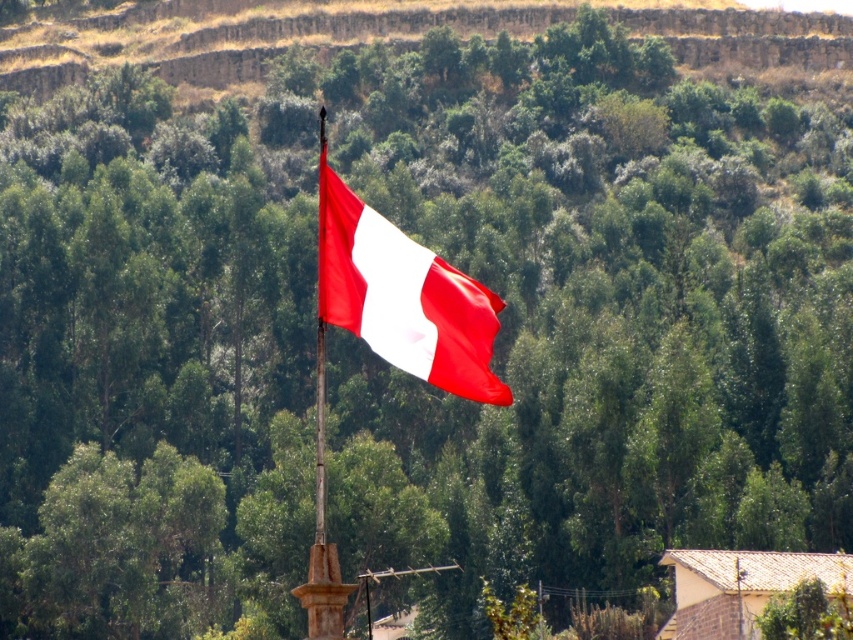
Is matte fabric flag at center positioned in front of smooth wood flag pole at center?

Yes, it is in front of smooth wood flag pole at center.

Can you confirm if matte fabric flag at center is thinner than smooth wood flag pole at center?

No.

The height and width of the screenshot is (640, 853). Identify the location of matte fabric flag at center. (403, 298).